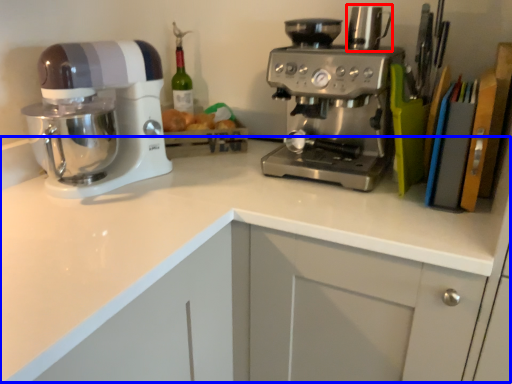
Question: Which object is closer to the camera taking this photo, appliance (highlighted by a red box) or counter top (highlighted by a blue box)?

Choices:
 (A) appliance
 (B) counter top

Answer: (B)